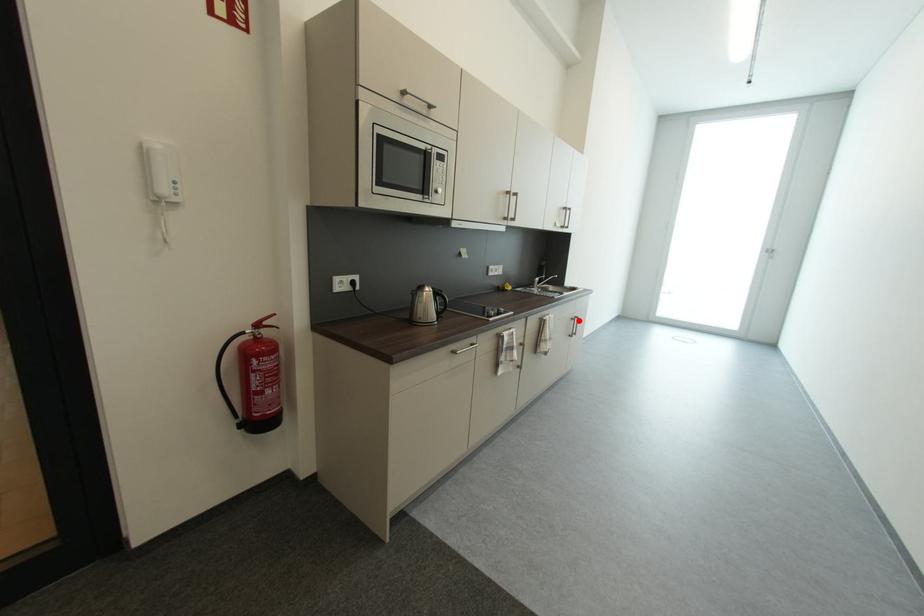
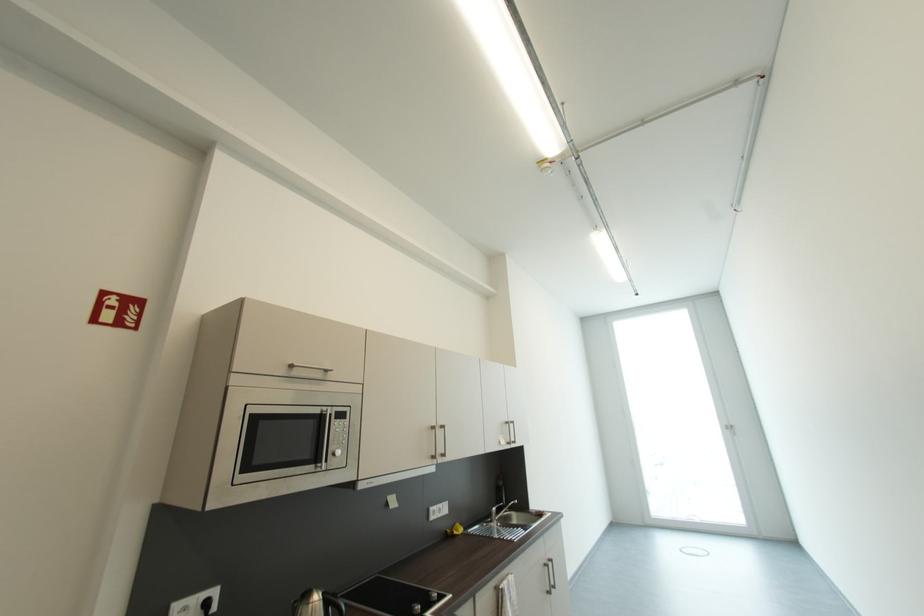
Question: I am providing you with two images of the same scene from different viewpoints. A red point is shown in image1. For the corresponding object point in image2, is it positioned nearer or farther from the camera?

Choices:
 (A) Nearer
 (B) Farther

Answer: (A)